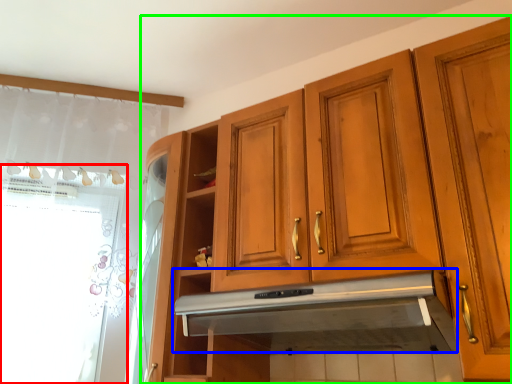
Question: Based on their relative distances, which object is nearer to window screen (highlighted by a red box)? Choose from exhaust hood (highlighted by a blue box) and cabinetry (highlighted by a green box).

Choices:
 (A) exhaust hood
 (B) cabinetry

Answer: (B)